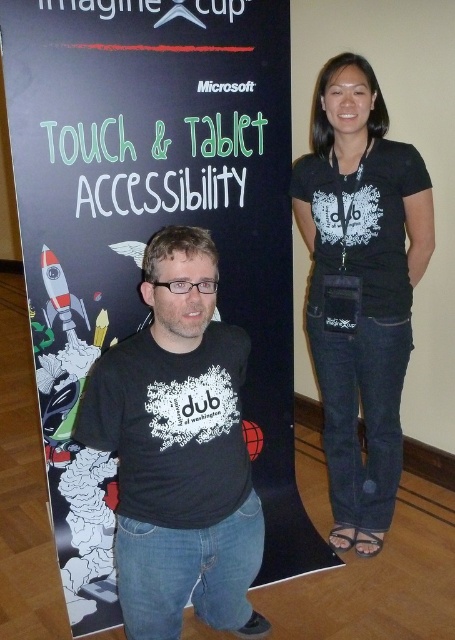
Can you confirm if black matte t-shirt at center is positioned to the left of black matte shirt at center?

Yes, black matte t-shirt at center is to the left of black matte shirt at center.

Does point (197, 268) come in front of point (389, 156)?

Yes, point (197, 268) is closer to viewer.

Identify the location of black matte t-shirt at center. (178, 451).